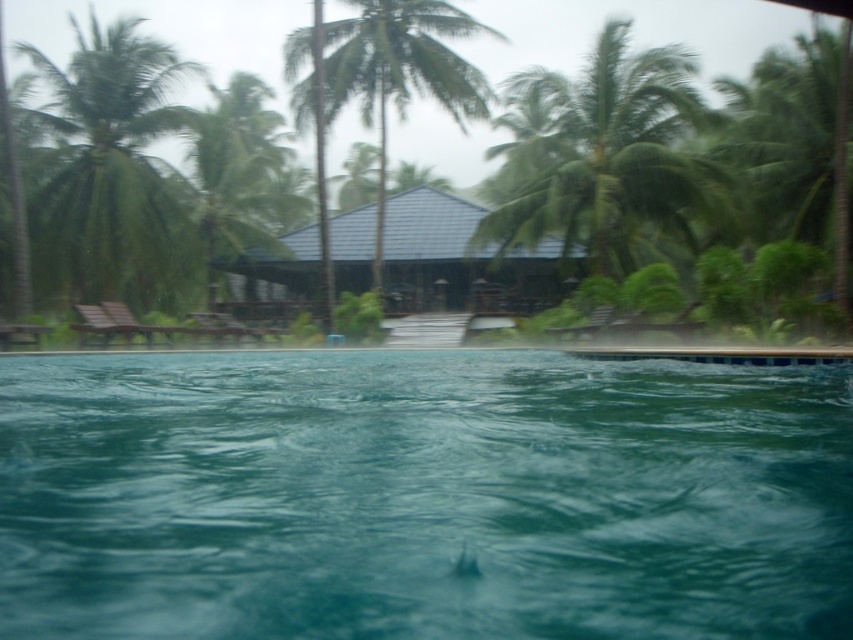
Question: Can you confirm if green glossy pool at center is bigger than green leafy palm tree at upper center?

Choices:
 (A) no
 (B) yes

Answer: (A)

Question: Which point appears closest to the camera in this image?

Choices:
 (A) (599, 179)
 (B) (70, 179)
 (C) (212, 184)

Answer: (A)

Question: Is green leafy palm tree at upper center bigger than green leafy palm tree at left?

Choices:
 (A) no
 (B) yes

Answer: (B)

Question: Can you confirm if green leafy palm tree at upper right is smaller than green leafy palm tree at upper left?

Choices:
 (A) no
 (B) yes

Answer: (A)

Question: Among these objects, which one is farthest from the camera?

Choices:
 (A) brown wooden hut at center
 (B) green leafy palm tree at center
 (C) green leafy palm tree at left

Answer: (A)

Question: Which of the following is the closest to the observer?

Choices:
 (A) (245, 141)
 (B) (236, 269)

Answer: (B)